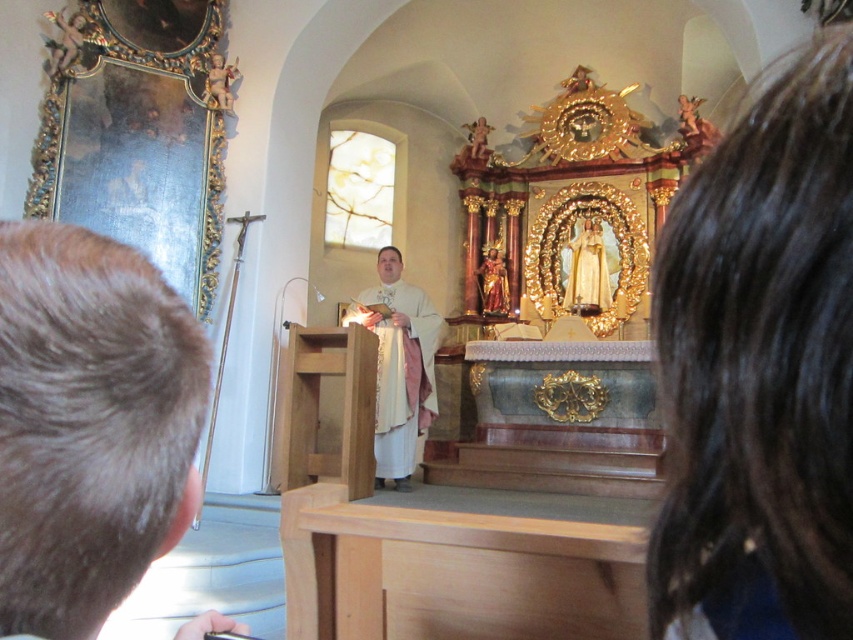
You are a GUI agent. You are given a task and a screenshot of the screen. Output one action in this format:
    pyautogui.click(x=<x>, y=<y>)
    Task: Click on the dark brown hair at upper right
    The height and width of the screenshot is (640, 853).
    Given the screenshot: What is the action you would take?
    pyautogui.click(x=759, y=369)

Does point (802, 326) come in front of point (79, 284)?

Yes, point (802, 326) is closer to viewer.

Locate an element on the screen. dark brown hair at upper right is located at coordinates (759, 369).

Which is above, dark brown hair at upper right or white cloth at center?

Positioned higher is dark brown hair at upper right.

From the picture: Does dark brown hair at upper right appear over white cloth at center?

Indeed, dark brown hair at upper right is positioned over white cloth at center.

At what (x,y) coordinates should I click in order to perform the action: click on dark brown hair at upper right. Please return your answer as a coordinate pair (x, y). Looking at the image, I should click on (759, 369).

Which is above, brown hair at left or white cloth at center?

brown hair at left

Does brown hair at left have a smaller size compared to white cloth at center?

Correct, brown hair at left occupies less space than white cloth at center.

Is point (71, 435) farther from camera compared to point (398, 280)?

No.

The image size is (853, 640). In order to click on brown hair at left in this screenshot , I will do `click(90, 426)`.